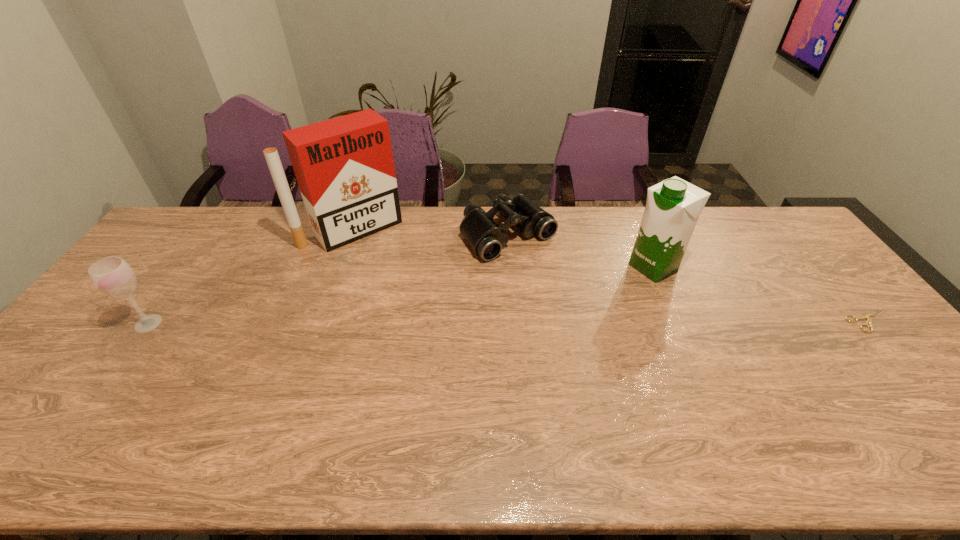
Identify the location of the third tallest object. The image size is (960, 540). (113, 276).

Identify the location of wineglass. (113, 276).

The width and height of the screenshot is (960, 540). Find the location of `shears`. shears is located at coordinates (868, 320).

This screenshot has height=540, width=960. Find the location of `the shortest object`. the shortest object is located at coordinates (868, 320).

Locate an element on the screen. The width and height of the screenshot is (960, 540). binoculars is located at coordinates click(486, 238).

This screenshot has height=540, width=960. I want to click on the second shortest object, so click(x=486, y=238).

The width and height of the screenshot is (960, 540). In order to click on the second object from right to left in this screenshot , I will do (x=673, y=206).

Where is `the second tallest object`? Image resolution: width=960 pixels, height=540 pixels. the second tallest object is located at coordinates (673, 206).

Where is `the second object from left to right`? This screenshot has width=960, height=540. the second object from left to right is located at coordinates (344, 166).

Image resolution: width=960 pixels, height=540 pixels. I want to click on the tallest object, so click(344, 166).